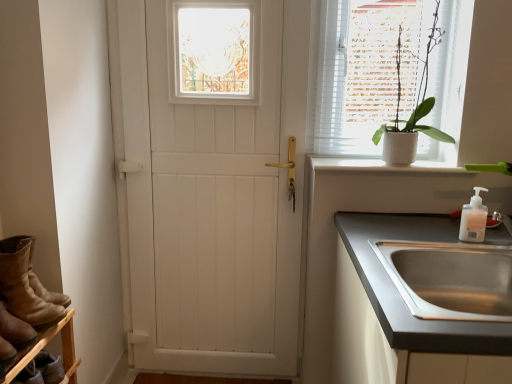
Question: Considering their positions, is white smooth window sill at upper right located in front of or behind white matte door at center?

Choices:
 (A) front
 (B) behind

Answer: (A)

Question: Looking at their shapes, would you say white smooth window sill at upper right is wider or thinner than white matte door at center?

Choices:
 (A) thin
 (B) wide

Answer: (B)

Question: Which object is the closest to the white matte pot at upper right?

Choices:
 (A) white matte door at center
 (B) brown suede boots at lower left
 (C) stainless steel sink at lower right
 (D) white smooth window sill at upper right
 (E) white plastic soap dispenser at upper right

Answer: (D)

Question: Considering the real-world distances, which object is farthest from the white matte pot at upper right?

Choices:
 (A) stainless steel sink at lower right
 (B) white plastic soap dispenser at upper right
 (C) white smooth window sill at upper right
 (D) brown wooden shelf at lower left
 (E) brown suede boots at lower left

Answer: (D)